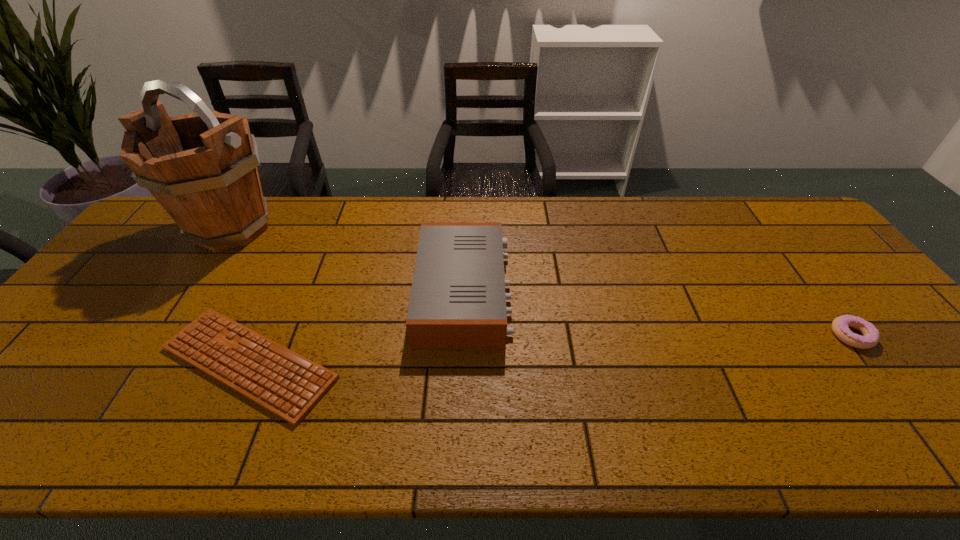
In order to click on free space between the second tallest object and the bucket in this screenshot , I will do `click(348, 260)`.

Locate an element on the screen. vacant area between the bucket and the computer keyboard is located at coordinates (241, 295).

You are a GUI agent. You are given a task and a screenshot of the screen. Output one action in this format:
    pyautogui.click(x=<x>, y=<y>)
    Task: Click on the vacant space in between the tallest object and the third object from left to right
    Image resolution: width=960 pixels, height=540 pixels.
    Given the screenshot: What is the action you would take?
    pyautogui.click(x=348, y=260)

Locate an element on the screen. The width and height of the screenshot is (960, 540). free spot between the shortest object and the tallest object is located at coordinates (241, 295).

The image size is (960, 540). What are the coordinates of `unoccupied area between the computer keyboard and the bucket` in the screenshot? It's located at (241, 295).

Locate an element on the screen. The height and width of the screenshot is (540, 960). free space between the computer keyboard and the rightmost object is located at coordinates (550, 349).

Locate an element on the screen. free space between the bucket and the second shortest object is located at coordinates (541, 282).

Where is `vacant area between the rightmost object and the computer keyboard`? Image resolution: width=960 pixels, height=540 pixels. vacant area between the rightmost object and the computer keyboard is located at coordinates (550, 349).

Locate an element on the screen. The width and height of the screenshot is (960, 540). free spot between the shortest object and the rightmost object is located at coordinates (550, 349).

Identify which object is the closest to the third tallest object. Please provide its 2D coordinates. Your answer should be formatted as a tuple, i.e. [(x, y)], where the tuple contains the x and y coordinates of a point satisfying the conditions above.

[(458, 302)]